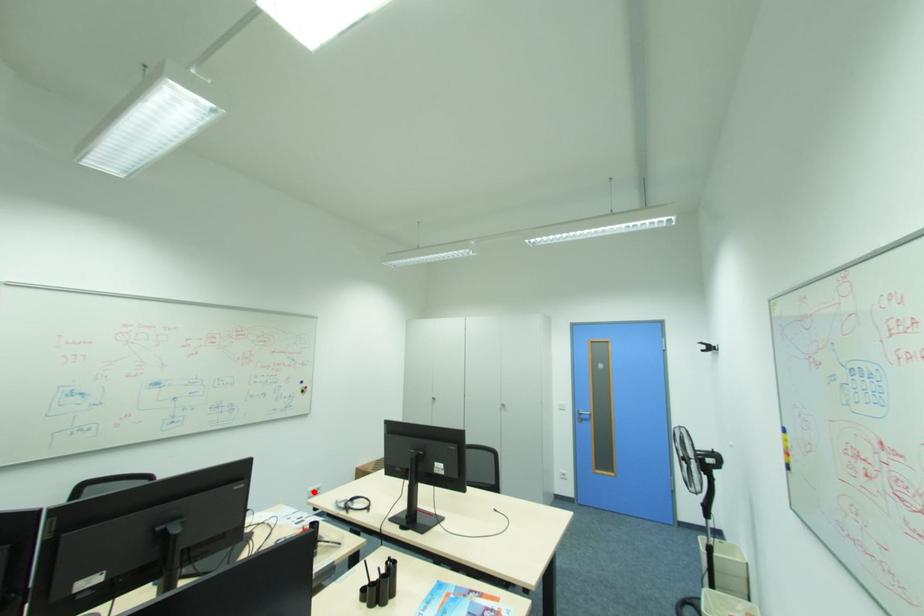
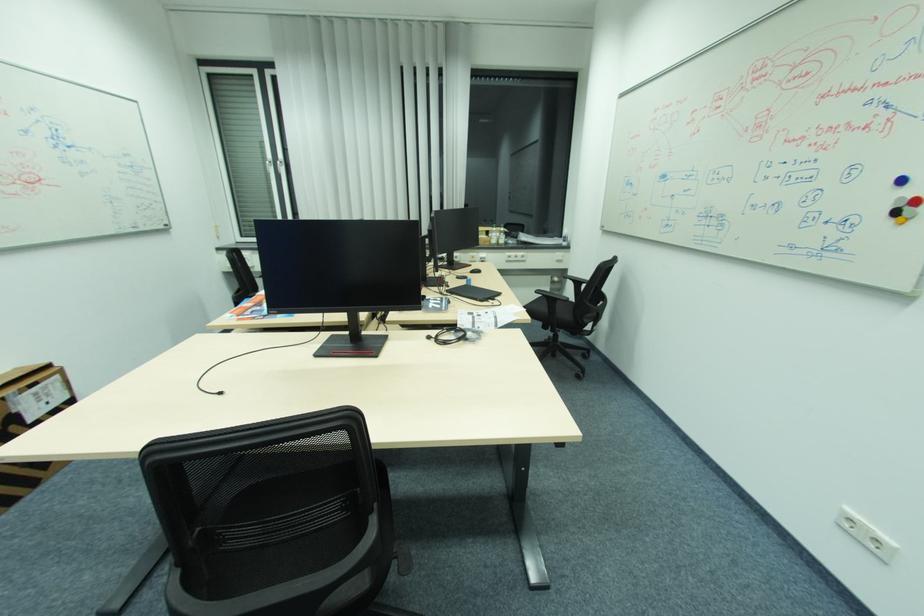
In the second image, find the point that corresponds to the highlighted location in the first image.

(848, 511)